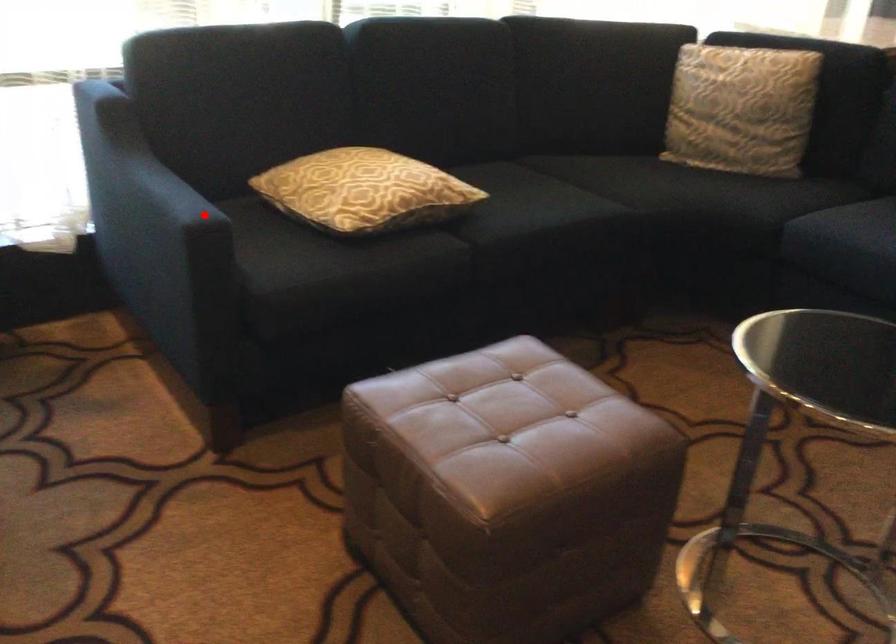
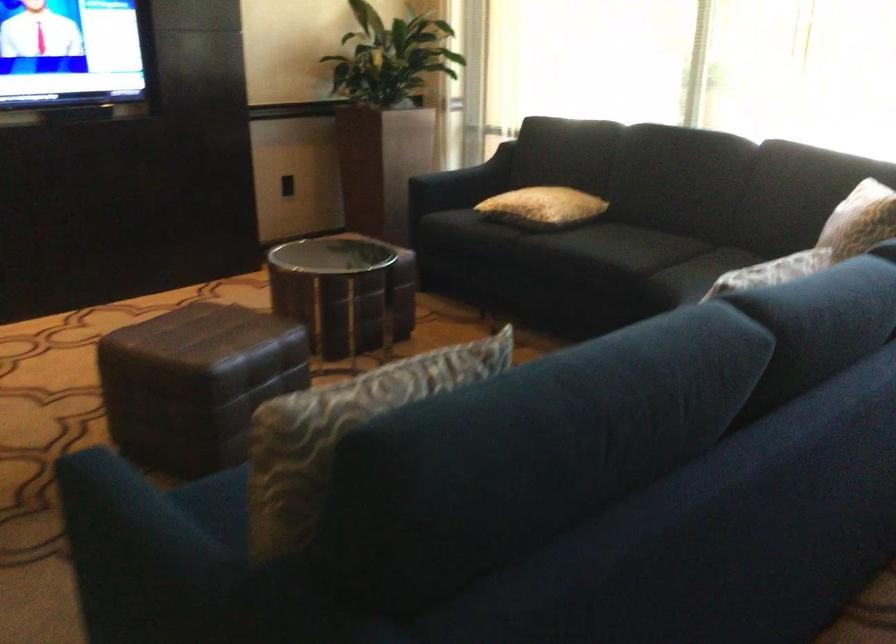
Question: I am providing you with two images of the same scene from different viewpoints. A red point is shown in image1. For the corresponding object point in image2, is it positioned nearer or farther from the camera?

Choices:
 (A) Nearer
 (B) Farther

Answer: (B)